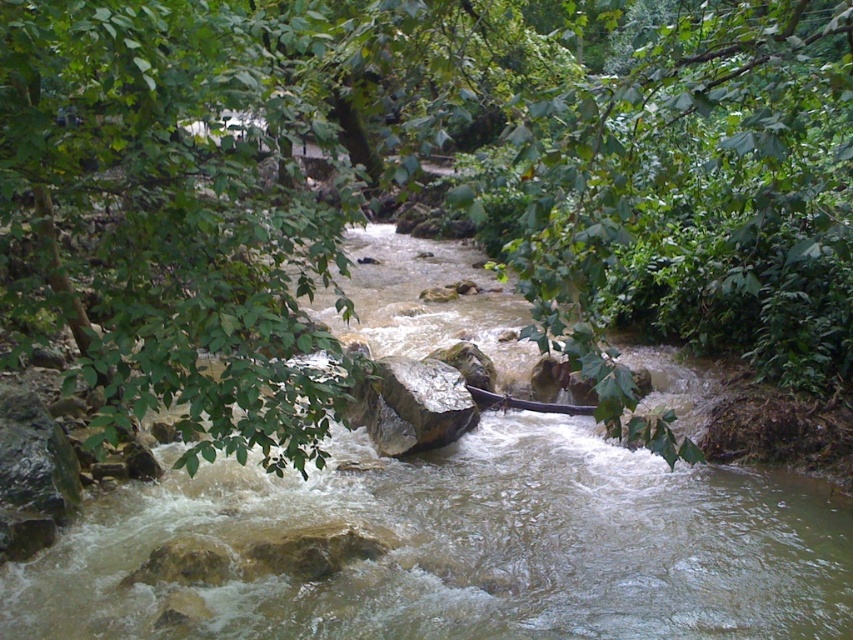
Does brown rocky stream at center come in front of brown wooden canoe at center?

Yes, it is in front of brown wooden canoe at center.

Does brown rocky stream at center have a greater width compared to brown wooden canoe at center?

Indeed, brown rocky stream at center has a greater width compared to brown wooden canoe at center.

At what (x,y) coordinates should I click in order to perform the action: click on brown rocky stream at center. Please return your answer as a coordinate pair (x, y). Image resolution: width=853 pixels, height=640 pixels. Looking at the image, I should click on (469, 547).